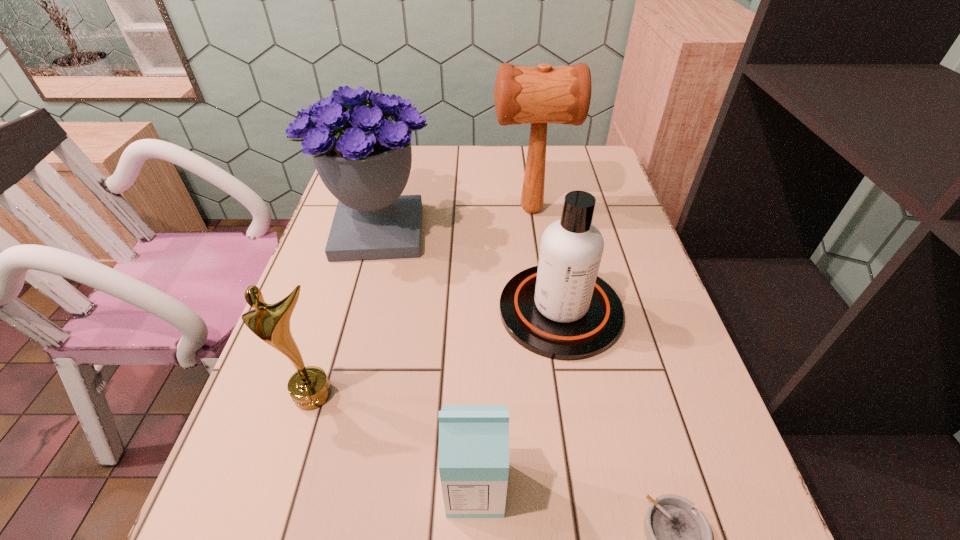
Identify the location of free space at the near left corner. This screenshot has width=960, height=540. (225, 530).

Where is `vacant space that is in between the mallet and the bouquet`? The width and height of the screenshot is (960, 540). vacant space that is in between the mallet and the bouquet is located at coordinates (455, 220).

You are a GUI agent. You are given a task and a screenshot of the screen. Output one action in this format:
    pyautogui.click(x=<x>, y=<y>)
    Task: Click on the free space that is in between the cleansing agent and the bouquet
    The height and width of the screenshot is (540, 960).
    Given the screenshot: What is the action you would take?
    pyautogui.click(x=469, y=271)

In order to click on blank region between the bouquet and the mallet in this screenshot , I will do `click(455, 220)`.

At what (x,y) coordinates should I click in order to perform the action: click on vacant area between the award and the bouquet. Please return your answer as a coordinate pair (x, y). The height and width of the screenshot is (540, 960). Looking at the image, I should click on (347, 313).

This screenshot has width=960, height=540. Find the location of `free spot between the fourth farthest object and the cleansing agent`. free spot between the fourth farthest object and the cleansing agent is located at coordinates (437, 352).

Find the location of a particular element. empty location between the bouquet and the second shortest object is located at coordinates (427, 360).

Identify which object is the third closest to the mallet. Please provide its 2D coordinates. Your answer should be formatted as a tuple, i.e. [(x, y)], where the tuple contains the x and y coordinates of a point satisfying the conditions above.

[(309, 387)]

Locate an element on the screen. object that is the fourth closest to the cleansing agent is located at coordinates (679, 539).

This screenshot has width=960, height=540. Identify the location of vacant region that satisfies the following two spatial constraints: 1. on the strike surface of the mallet; 2. on the front-facing side of the award. (557, 394).